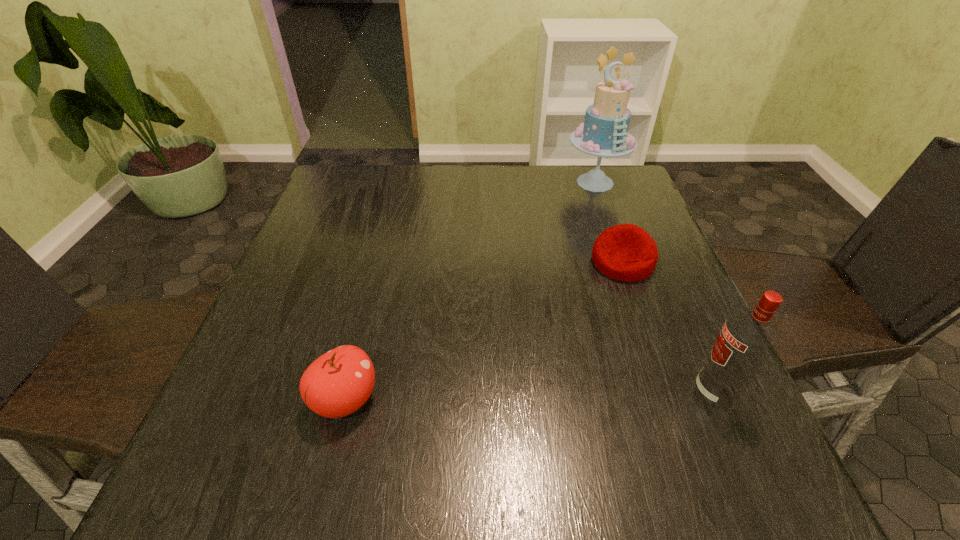
At what (x,y) coordinates should I click in order to perform the action: click on vacant region between the beanbag and the third tallest object. Please return your answer as a coordinate pair (x, y). Looking at the image, I should click on (484, 331).

You are a GUI agent. You are given a task and a screenshot of the screen. Output one action in this format:
    pyautogui.click(x=<x>, y=<y>)
    Task: Click on the object that can be found as the third closest to the shortest object
    The height and width of the screenshot is (540, 960).
    Given the screenshot: What is the action you would take?
    pyautogui.click(x=339, y=382)

Find the location of `object that is the closest to the shortest object`. object that is the closest to the shortest object is located at coordinates (604, 133).

Where is `free space in the image that satisfies the following two spatial constraints: 1. on the back side of the apple; 2. on the right side of the tallest object`? The image size is (960, 540). free space in the image that satisfies the following two spatial constraints: 1. on the back side of the apple; 2. on the right side of the tallest object is located at coordinates [x=400, y=183].

What are the coordinates of `blank space that satisfies the following two spatial constraints: 1. on the back side of the leftmost object; 2. on the front label of the third shortest object` in the screenshot? It's located at (347, 393).

Where is `vacant region that satisfies the following two spatial constraints: 1. on the back side of the cake; 2. on the right side of the leftmost object`? Image resolution: width=960 pixels, height=540 pixels. vacant region that satisfies the following two spatial constraints: 1. on the back side of the cake; 2. on the right side of the leftmost object is located at coordinates (400, 183).

At what (x,y) coordinates should I click in order to perform the action: click on vacant area that satisfies the following two spatial constraints: 1. on the back side of the leftmost object; 2. on the right side of the farthest object. Please return your answer as a coordinate pair (x, y). Looking at the image, I should click on (400, 183).

Locate an element on the screen. vacant space that satisfies the following two spatial constraints: 1. on the back side of the shortest object; 2. on the left side of the apple is located at coordinates (380, 262).